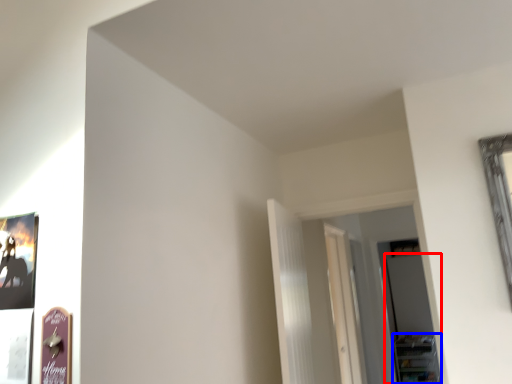
Question: Which object appears closest to the camera in this image, glass door (highlighted by a red box) or shelf (highlighted by a blue box)?

Choices:
 (A) glass door
 (B) shelf

Answer: (A)